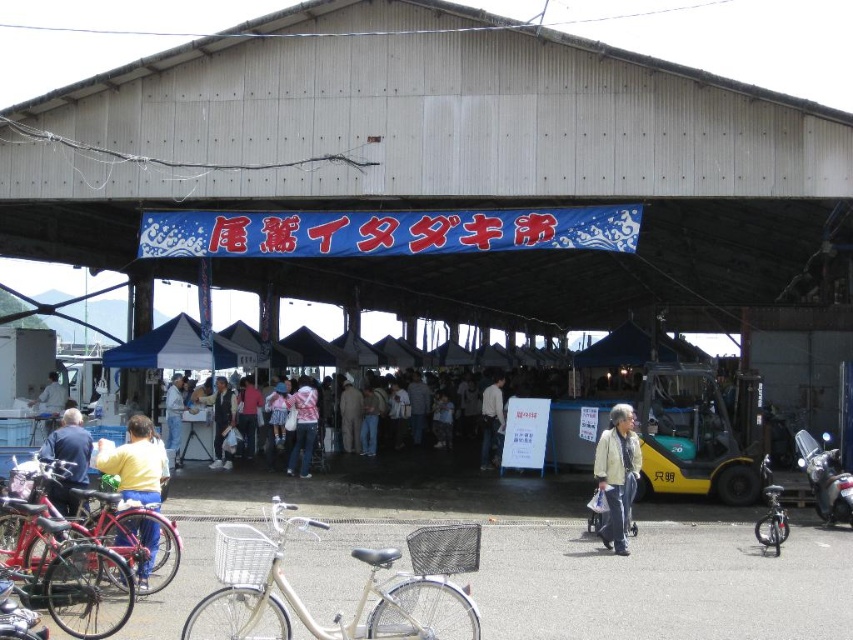
Question: Is light beige jacket at center below black matte bicycle at lower right?

Choices:
 (A) yes
 (B) no

Answer: (B)

Question: From the image, what is the correct spatial relationship of khaki fabric pants at center in relation to light blue fabric jacket at center?

Choices:
 (A) below
 (B) above

Answer: (A)

Question: Which of these objects is positioned closest to the red matte bicycle at lower left?

Choices:
 (A) yellow sweater at lower left
 (B) blue denim jacket at center

Answer: (A)

Question: Observing the image, what is the correct spatial positioning of light brown leather jacket at center in reference to matte pink shirt at center?

Choices:
 (A) left
 (B) right

Answer: (B)

Question: Which of the following is the farthest from the observer?

Choices:
 (A) click(161, 544)
 (B) click(55, 397)
 (C) click(231, 422)

Answer: (B)

Question: Estimate the real-world distances between objects in this image. Which object is closer to the denim jeans at center?

Choices:
 (A) yellow sweater at lower left
 (B) silver metallic bicycle at lower center
 (C) blue denim jacket at center
 (D) light brown leather jacket at center

Answer: (D)